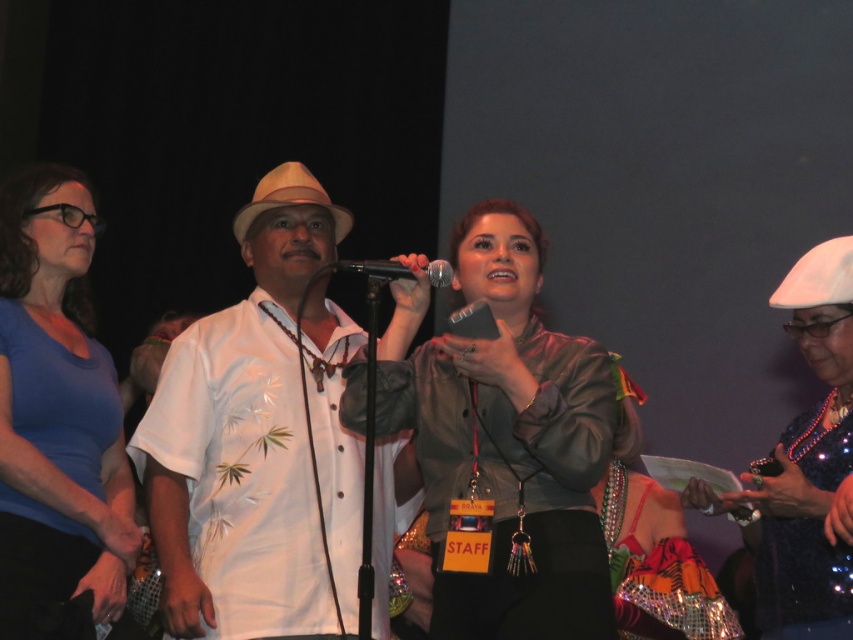
Is blue matte shirt at left thinner than sparkly blue dress at center?

Yes, blue matte shirt at left is thinner than sparkly blue dress at center.

Does point (65, 298) come closer to viewer compared to point (805, 339)?

No, it is behind (805, 339).

Locate an element on the screen. Image resolution: width=853 pixels, height=640 pixels. blue matte shirt at left is located at coordinates (56, 410).

This screenshot has height=640, width=853. In order to click on white matte shirt at center in this screenshot , I will do `click(258, 438)`.

What are the coordinates of `white matte shirt at center` in the screenshot? It's located at (258, 438).

Is shiny metallic jacket at center in front of shiny black microphone at center?

Yes.

How far apart are shiny metallic jacket at center and shiny black microphone at center?

The distance of shiny metallic jacket at center from shiny black microphone at center is 14.31 inches.

I want to click on shiny metallic jacket at center, so click(506, 436).

Locate an element on the screen. shiny metallic jacket at center is located at coordinates (506, 436).